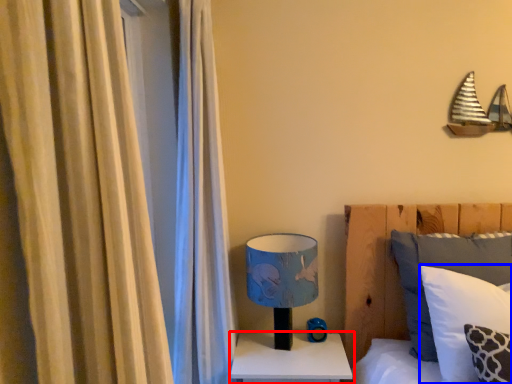
Question: Which object appears closest to the camera in this image, nightstand (highlighted by a red box) or pillow (highlighted by a blue box)?

Choices:
 (A) nightstand
 (B) pillow

Answer: (B)